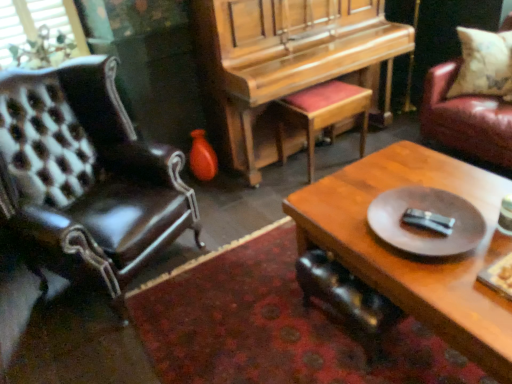
Question: Is leather chair at left, the second chair viewed from the right, next to wooden coffee table at center and touching it?

Choices:
 (A) yes
 (B) no

Answer: (B)

Question: Can you confirm if leather chair at left, the second chair viewed from the right, is smaller than wooden coffee table at center?

Choices:
 (A) no
 (B) yes

Answer: (A)

Question: Considering the relative sizes of leather chair at left, the second chair viewed from the right, and wooden coffee table at center in the image provided, is leather chair at left, the second chair viewed from the right, wider than wooden coffee table at center?

Choices:
 (A) no
 (B) yes

Answer: (A)

Question: Does leather chair at left, the second chair viewed from the right, lie in front of wooden coffee table at center?

Choices:
 (A) yes
 (B) no

Answer: (B)

Question: From the image's perspective, would you say leather chair at left, the second chair viewed from the right, is shown under wooden coffee table at center?

Choices:
 (A) no
 (B) yes

Answer: (A)

Question: Is leather chair at left, the second chair viewed from the right, positioned with its back to wooden coffee table at center?

Choices:
 (A) no
 (B) yes

Answer: (A)

Question: From the image's perspective, is shiny orange vase at center under wooden piano at center?

Choices:
 (A) no
 (B) yes

Answer: (B)

Question: Is shiny orange vase at center far from wooden piano at center?

Choices:
 (A) no
 (B) yes

Answer: (A)

Question: From a real-world perspective, is shiny orange vase at center positioned over wooden piano at center based on gravity?

Choices:
 (A) no
 (B) yes

Answer: (A)

Question: Is shiny orange vase at center not within wooden piano at center?

Choices:
 (A) no
 (B) yes

Answer: (B)

Question: Does shiny orange vase at center come behind wooden piano at center?

Choices:
 (A) no
 (B) yes

Answer: (B)

Question: From the image's perspective, would you say shiny orange vase at center is positioned over wooden piano at center?

Choices:
 (A) no
 (B) yes

Answer: (A)

Question: Is white mesh window screen at upper left located outside wooden coffee table at center?

Choices:
 (A) no
 (B) yes

Answer: (B)